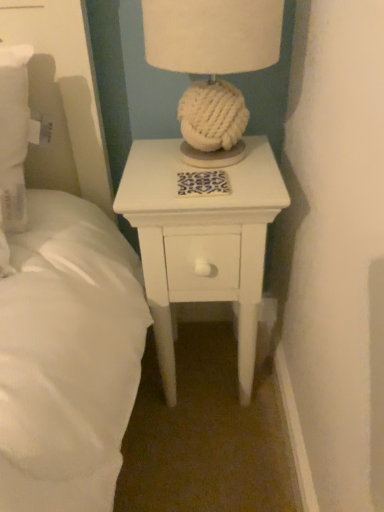
Question: From the image's perspective, is white knitted ball at center over white painted wood nightstand at center?

Choices:
 (A) yes
 (B) no

Answer: (A)

Question: From the image's perspective, would you say white knitted ball at center is shown under white painted wood nightstand at center?

Choices:
 (A) yes
 (B) no

Answer: (B)

Question: Does white knitted ball at center appear on the left side of white painted wood nightstand at center?

Choices:
 (A) no
 (B) yes

Answer: (A)

Question: Does white knitted ball at center lie in front of white painted wood nightstand at center?

Choices:
 (A) no
 (B) yes

Answer: (B)

Question: Is white knitted ball at center facing away from white painted wood nightstand at center?

Choices:
 (A) yes
 (B) no

Answer: (B)

Question: Is white knitted ball at center far from white painted wood nightstand at center?

Choices:
 (A) no
 (B) yes

Answer: (A)

Question: Considering the relative sizes of white painted wood nightstand at center and white knitted ball at center in the image provided, is white painted wood nightstand at center shorter than white knitted ball at center?

Choices:
 (A) no
 (B) yes

Answer: (A)

Question: From the image's perspective, is white painted wood nightstand at center on top of white knitted ball at center?

Choices:
 (A) yes
 (B) no

Answer: (B)

Question: Considering the relative sizes of white painted wood nightstand at center and white knitted ball at center in the image provided, is white painted wood nightstand at center wider than white knitted ball at center?

Choices:
 (A) yes
 (B) no

Answer: (A)

Question: Does white painted wood nightstand at center appear on the right side of white knitted ball at center?

Choices:
 (A) yes
 (B) no

Answer: (B)

Question: Is white painted wood nightstand at center closer to camera compared to white knitted ball at center?

Choices:
 (A) yes
 (B) no

Answer: (B)

Question: From the image's perspective, is white painted wood nightstand at center beneath white knitted ball at center?

Choices:
 (A) yes
 (B) no

Answer: (A)

Question: Considering the positions of point (142, 233) and point (213, 47), is point (142, 233) closer or farther from the camera than point (213, 47)?

Choices:
 (A) closer
 (B) farther

Answer: (B)